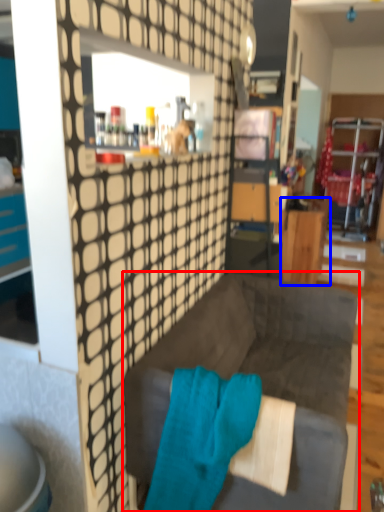
Question: Which object appears farthest to the camera in this image, studio couch (highlighted by a red box) or desk (highlighted by a blue box)?

Choices:
 (A) studio couch
 (B) desk

Answer: (B)